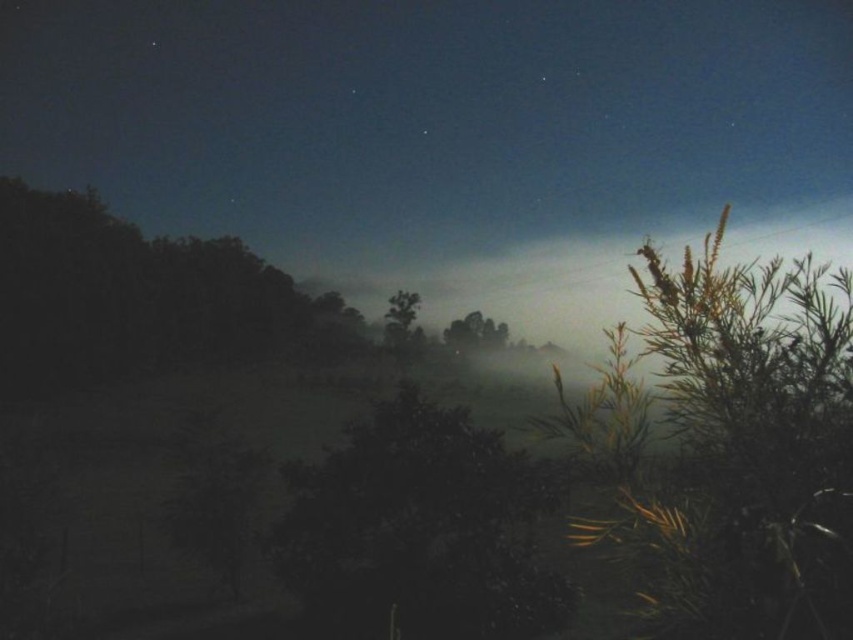
You are standing in the night scene and want to walk from the point closer to you to the farther point. Which path would you take between the two points, point (635,497) and point (457,461)?

You should walk from point (635,497) to point (457,461) because point (635,497) is closer to the viewer and the other point is farther away.